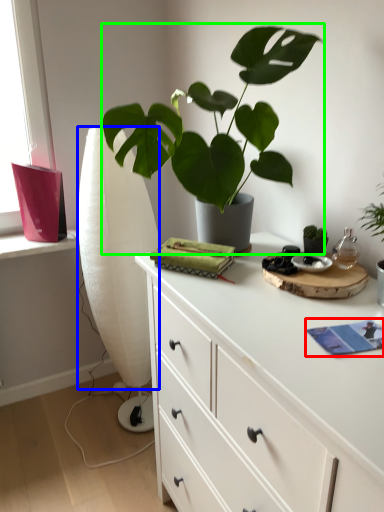
Question: Considering the real-world distances, which object is closest to book (highlighted by a red box)? curtain (highlighted by a blue box) or houseplant (highlighted by a green box).

Choices:
 (A) curtain
 (B) houseplant

Answer: (B)